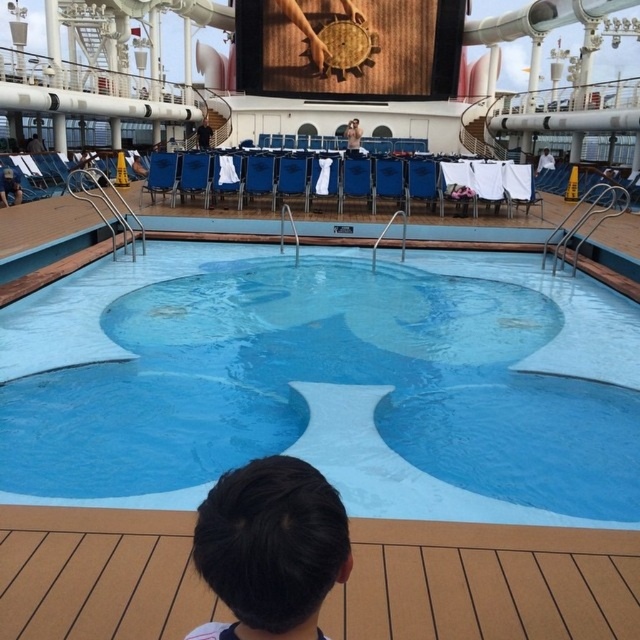
You are standing on the deck of the cruise ship and want to take a photo of the dark brown hair at lower center and the blue fabric chair at center. Which object should you frame first in your camera viewfinder to ensure both are in the shot?

You should frame the blue fabric chair at center first because the dark brown hair at lower center is to the right of it, so starting with the chair ensures both objects are included in the photo.

You are standing on the deck of the cruise ship and see the blue smooth pool at center and the dark brown hair at lower center. Which object is closer to you?

The dark brown hair at lower center is closer to you because it is in front of the blue smooth pool at center.